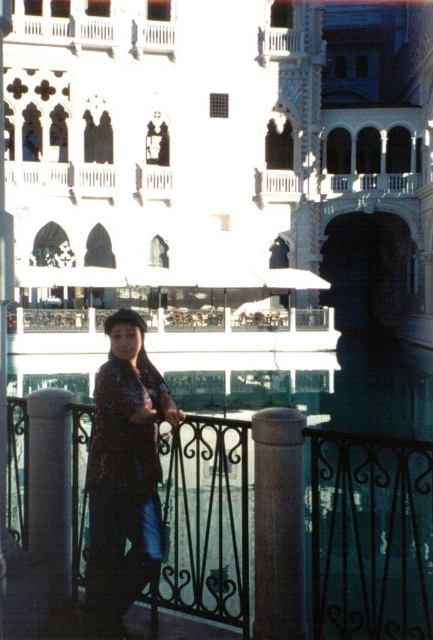
You are a photographer trying to capture a photo of the person on the balcony. You notice the shiny purple blouse at center and the smooth gray post at center. Which object is positioned to the left of the other?

The shiny purple blouse at center is to the left of the smooth gray post at center.

From the picture: You are an architect analyzing the proportions of the buildings in the image. Which object, the white stone palace at center or the white glossy pillar at left, would you say is bigger in size?

The white stone palace at center is larger in size compared to the white glossy pillar at left.